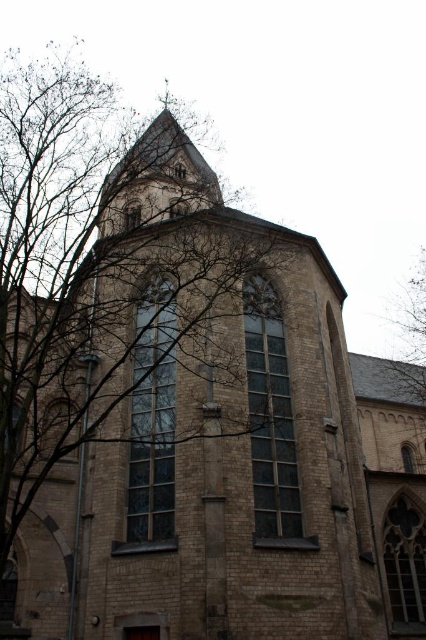
You are an architect examining the church facade. You notice the clear glass window at center and the green leafy tree at upper left. Which object occupies a larger area on the facade?

The green leafy tree at upper left occupies a larger area on the facade than the clear glass window at center.

You are standing in front of the historic church building. You want to locate the clear glass window at center. Where should you look?

You should look at point (x=152, y=419) to locate the clear glass window at center.

You are standing in front of the historic church building and notice two points marked on the tower. According to their positions, which point is closer to you, point (169,417) or point (416,385)?

Point (169,417) is in front of point (416,385), so it is closer to you.